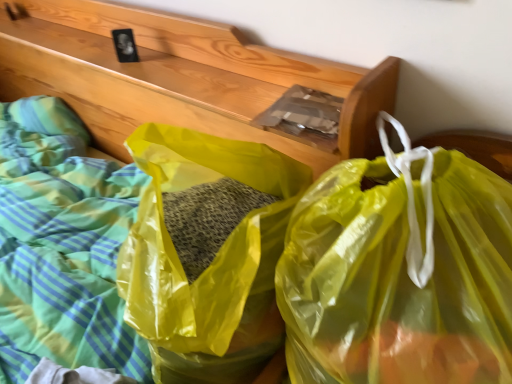
The height and width of the screenshot is (384, 512). Describe the element at coordinates (400, 271) in the screenshot. I see `translucent yellow plastic bag at center, which is the second plastic bag from left to right` at that location.

Locate an element on the screen. This screenshot has width=512, height=384. translucent yellow plastic bag at center, which is the second plastic bag from left to right is located at coordinates (400, 271).

How much space does translucent yellow plastic bag at center, marked as the first plastic bag in a right-to-left arrangement, occupy vertically?

translucent yellow plastic bag at center, marked as the first plastic bag in a right-to-left arrangement, is 19.48 inches in height.

Where is `yellow translucent plastic bag at center, the 2th plastic bag from the right`? yellow translucent plastic bag at center, the 2th plastic bag from the right is located at coordinates (207, 252).

In order to face yellow translucent plastic bag at center, acting as the first plastic bag starting from the left, should I rotate leftwards or rightwards?

A 6.851 degree turn to the left will do.

Describe the element at coordinates (207, 252) in the screenshot. I see `yellow translucent plastic bag at center, the 2th plastic bag from the right` at that location.

What is the approximate height of yellow translucent plastic bag at center, the 2th plastic bag from the right?

17.87 inches.

This screenshot has width=512, height=384. Identify the location of translucent yellow plastic bag at center, marked as the first plastic bag in a right-to-left arrangement. click(x=400, y=271).

Is yellow translucent plastic bag at center, the 2th plastic bag from the right, to the left of translucent yellow plastic bag at center, which is the second plastic bag from left to right, from the viewer's perspective?

Yes, yellow translucent plastic bag at center, the 2th plastic bag from the right, is to the left of translucent yellow plastic bag at center, which is the second plastic bag from left to right.

Is yellow translucent plastic bag at center, acting as the first plastic bag starting from the left, further to camera compared to translucent yellow plastic bag at center, which is the second plastic bag from left to right?

Yes, yellow translucent plastic bag at center, acting as the first plastic bag starting from the left, is behind translucent yellow plastic bag at center, which is the second plastic bag from left to right.

Which point is more forward, (149, 220) or (292, 331)?

Point (292, 331)

Based on the photo, from the image's perspective, is yellow translucent plastic bag at center, acting as the first plastic bag starting from the left, located beneath translucent yellow plastic bag at center, which is the second plastic bag from left to right?

Actually, yellow translucent plastic bag at center, acting as the first plastic bag starting from the left, appears above translucent yellow plastic bag at center, which is the second plastic bag from left to right, in the image.

From a real-world perspective, is yellow translucent plastic bag at center, the 2th plastic bag from the right, below translucent yellow plastic bag at center, which is the second plastic bag from left to right?

Yes, from a real-world perspective, yellow translucent plastic bag at center, the 2th plastic bag from the right, is beneath translucent yellow plastic bag at center, which is the second plastic bag from left to right.

Can you confirm if yellow translucent plastic bag at center, the 2th plastic bag from the right, is thinner than translucent yellow plastic bag at center, which is the second plastic bag from left to right?

Incorrect, the width of yellow translucent plastic bag at center, the 2th plastic bag from the right, is not less than that of translucent yellow plastic bag at center, which is the second plastic bag from left to right.

Is yellow translucent plastic bag at center, acting as the first plastic bag starting from the left, shorter than translucent yellow plastic bag at center, which is the second plastic bag from left to right?

Yes.

Is yellow translucent plastic bag at center, the 2th plastic bag from the right, bigger or smaller than translucent yellow plastic bag at center, marked as the first plastic bag in a right-to-left arrangement?

Clearly, yellow translucent plastic bag at center, the 2th plastic bag from the right, is larger in size than translucent yellow plastic bag at center, marked as the first plastic bag in a right-to-left arrangement.

Is translucent yellow plastic bag at center, marked as the first plastic bag in a right-to-left arrangement, located within yellow translucent plastic bag at center, acting as the first plastic bag starting from the left?

No, translucent yellow plastic bag at center, marked as the first plastic bag in a right-to-left arrangement, is not surrounded by yellow translucent plastic bag at center, acting as the first plastic bag starting from the left.

Is there a large distance between yellow translucent plastic bag at center, the 2th plastic bag from the right, and translucent yellow plastic bag at center, which is the second plastic bag from left to right?

yellow translucent plastic bag at center, the 2th plastic bag from the right, is near translucent yellow plastic bag at center, which is the second plastic bag from left to right, not far away.

Is yellow translucent plastic bag at center, the 2th plastic bag from the right, oriented away from translucent yellow plastic bag at center, which is the second plastic bag from left to right?

That's right, yellow translucent plastic bag at center, the 2th plastic bag from the right, is facing away from translucent yellow plastic bag at center, which is the second plastic bag from left to right.

How different are the orientations of yellow translucent plastic bag at center, acting as the first plastic bag starting from the left, and translucent yellow plastic bag at center, marked as the first plastic bag in a right-to-left arrangement, in degrees?

The angle between the facing direction of yellow translucent plastic bag at center, acting as the first plastic bag starting from the left, and the facing direction of translucent yellow plastic bag at center, marked as the first plastic bag in a right-to-left arrangement, is 76.1 degrees.

How distant is yellow translucent plastic bag at center, the 2th plastic bag from the right, from translucent yellow plastic bag at center, marked as the first plastic bag in a right-to-left arrangement?

yellow translucent plastic bag at center, the 2th plastic bag from the right, is 7.91 inches away from translucent yellow plastic bag at center, marked as the first plastic bag in a right-to-left arrangement.

Where is `plastic bag that is on the right side of yellow translucent plastic bag at center, acting as the first plastic bag starting from the left`? plastic bag that is on the right side of yellow translucent plastic bag at center, acting as the first plastic bag starting from the left is located at coordinates (400, 271).

Does translucent yellow plastic bag at center, marked as the first plastic bag in a right-to-left arrangement, appear on the right side of yellow translucent plastic bag at center, acting as the first plastic bag starting from the left?

Yes, translucent yellow plastic bag at center, marked as the first plastic bag in a right-to-left arrangement, is to the right of yellow translucent plastic bag at center, acting as the first plastic bag starting from the left.

Which object is closer to the camera taking this photo, translucent yellow plastic bag at center, marked as the first plastic bag in a right-to-left arrangement, or yellow translucent plastic bag at center, the 2th plastic bag from the right?

Positioned in front is translucent yellow plastic bag at center, marked as the first plastic bag in a right-to-left arrangement.

Considering the points (435, 172) and (152, 157), which point is in front, point (435, 172) or point (152, 157)?

Positioned in front is point (435, 172).

From the image's perspective, is translucent yellow plastic bag at center, marked as the first plastic bag in a right-to-left arrangement, under yellow translucent plastic bag at center, acting as the first plastic bag starting from the left?

Yes, from the image's perspective, translucent yellow plastic bag at center, marked as the first plastic bag in a right-to-left arrangement, is beneath yellow translucent plastic bag at center, acting as the first plastic bag starting from the left.

From a real-world perspective, is translucent yellow plastic bag at center, which is the second plastic bag from left to right, over yellow translucent plastic bag at center, the 2th plastic bag from the right?

Indeed, from a real-world perspective, translucent yellow plastic bag at center, which is the second plastic bag from left to right, stands above yellow translucent plastic bag at center, the 2th plastic bag from the right.

Between translucent yellow plastic bag at center, marked as the first plastic bag in a right-to-left arrangement, and yellow translucent plastic bag at center, the 2th plastic bag from the right, which one has smaller width?

translucent yellow plastic bag at center, marked as the first plastic bag in a right-to-left arrangement.

Is translucent yellow plastic bag at center, marked as the first plastic bag in a right-to-left arrangement, shorter than yellow translucent plastic bag at center, the 2th plastic bag from the right?

In fact, translucent yellow plastic bag at center, marked as the first plastic bag in a right-to-left arrangement, may be taller than yellow translucent plastic bag at center, the 2th plastic bag from the right.

In terms of size, does translucent yellow plastic bag at center, marked as the first plastic bag in a right-to-left arrangement, appear bigger or smaller than yellow translucent plastic bag at center, the 2th plastic bag from the right?

translucent yellow plastic bag at center, marked as the first plastic bag in a right-to-left arrangement, is smaller than yellow translucent plastic bag at center, the 2th plastic bag from the right.

Would you say translucent yellow plastic bag at center, which is the second plastic bag from left to right, contains yellow translucent plastic bag at center, acting as the first plastic bag starting from the left?

No, translucent yellow plastic bag at center, which is the second plastic bag from left to right, does not contain yellow translucent plastic bag at center, acting as the first plastic bag starting from the left.

Are translucent yellow plastic bag at center, marked as the first plastic bag in a right-to-left arrangement, and yellow translucent plastic bag at center, the 2th plastic bag from the right, beside each other?

No, translucent yellow plastic bag at center, marked as the first plastic bag in a right-to-left arrangement, is not beside yellow translucent plastic bag at center, the 2th plastic bag from the right.

Is translucent yellow plastic bag at center, which is the second plastic bag from left to right, facing towards yellow translucent plastic bag at center, the 2th plastic bag from the right?

No, translucent yellow plastic bag at center, which is the second plastic bag from left to right, is not aimed at yellow translucent plastic bag at center, the 2th plastic bag from the right.

How distant is translucent yellow plastic bag at center, marked as the first plastic bag in a right-to-left arrangement, from yellow translucent plastic bag at center, acting as the first plastic bag starting from the left?

7.91 inches.

I want to click on plastic bag positioned vertically above the yellow translucent plastic bag at center, acting as the first plastic bag starting from the left (from a real-world perspective), so click(x=400, y=271).

At what (x,y) coordinates should I click in order to perform the action: click on plastic bag on the right of yellow translucent plastic bag at center, the 2th plastic bag from the right. Please return your answer as a coordinate pair (x, y). Looking at the image, I should click on (400, 271).

This screenshot has height=384, width=512. Find the location of `plastic bag below the yellow translucent plastic bag at center, acting as the first plastic bag starting from the left (from the image's perspective)`. plastic bag below the yellow translucent plastic bag at center, acting as the first plastic bag starting from the left (from the image's perspective) is located at coordinates (400, 271).